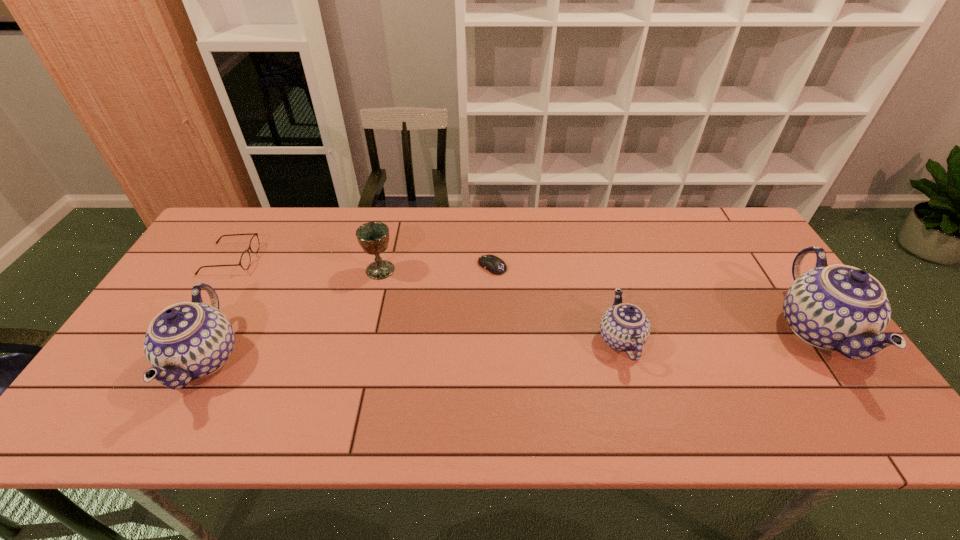
Please point a space for a new chinaware to maintain equal intervals. Please provide its 2D coordinates. Your answer should be formatted as a tuple, i.e. [(x, y)], where the tuple contains the x and y coordinates of a point satisfying the conditions above.

[(417, 349)]